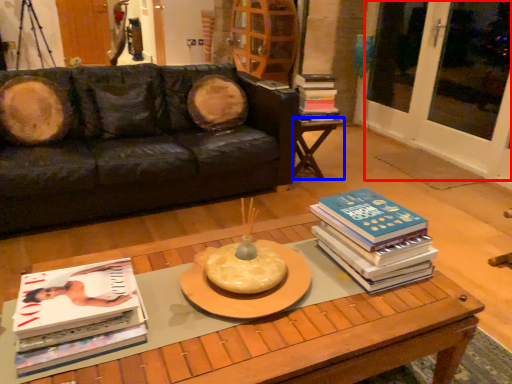
Question: Which object appears closest to the camera in this image, screen door (highlighted by a red box) or table (highlighted by a blue box)?

Choices:
 (A) screen door
 (B) table

Answer: (A)